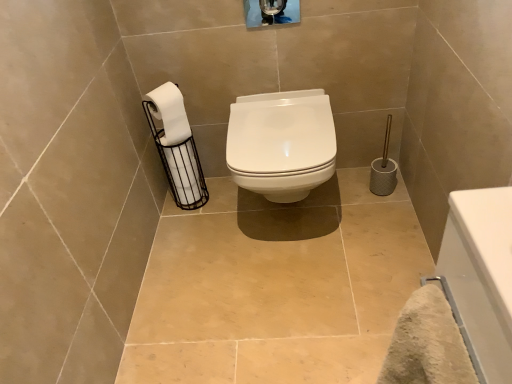
Question: Is white glossy toilet at center with white glossy bathtub at lower right?

Choices:
 (A) yes
 (B) no

Answer: (B)

Question: Considering the relative positions of white glossy toilet at center and white glossy bathtub at lower right in the image provided, is white glossy toilet at center in front of white glossy bathtub at lower right?

Choices:
 (A) yes
 (B) no

Answer: (B)

Question: Does white glossy toilet at center turn towards white glossy bathtub at lower right?

Choices:
 (A) no
 (B) yes

Answer: (B)

Question: From the image's perspective, is white glossy toilet at center below white glossy bathtub at lower right?

Choices:
 (A) no
 (B) yes

Answer: (A)

Question: Is white glossy toilet at center positioned with its back to white glossy bathtub at lower right?

Choices:
 (A) no
 (B) yes

Answer: (A)

Question: Would you say white matte toilet paper at left, marked as the first toilet paper in a front-to-back arrangement, is to the left or to the right of white glossy toilet at center in the picture?

Choices:
 (A) right
 (B) left

Answer: (B)

Question: Based on their sizes in the image, would you say white matte toilet paper at left, marked as the first toilet paper in a front-to-back arrangement, is bigger or smaller than white glossy toilet at center?

Choices:
 (A) small
 (B) big

Answer: (A)

Question: Relative to white glossy toilet at center, is white matte toilet paper at left, marked as the first toilet paper in a front-to-back arrangement, in front or behind?

Choices:
 (A) front
 (B) behind

Answer: (B)

Question: In terms of height, does white matte toilet paper at left, marked as the first toilet paper in a front-to-back arrangement, look taller or shorter compared to white glossy toilet at center?

Choices:
 (A) short
 (B) tall

Answer: (A)

Question: Is point (459, 316) positioned closer to the camera than point (162, 114)?

Choices:
 (A) closer
 (B) farther

Answer: (A)

Question: Relative to white matte toilet paper at left, marked as the first toilet paper in a front-to-back arrangement, is white glossy bathtub at lower right in front or behind?

Choices:
 (A) behind
 (B) front

Answer: (B)

Question: Do you think white glossy bathtub at lower right is within white matte toilet paper at left, which is counted as the second toilet paper, starting from the back, or outside of it?

Choices:
 (A) inside
 (B) outside

Answer: (B)

Question: From the image's perspective, is white glossy bathtub at lower right above or below white matte toilet paper at left, marked as the first toilet paper in a front-to-back arrangement?

Choices:
 (A) below
 (B) above

Answer: (A)

Question: Visually, is white matte toilet paper at left, which is counted as the second toilet paper, starting from the back, positioned to the left or to the right of white glossy bathtub at lower right?

Choices:
 (A) left
 (B) right

Answer: (A)

Question: Is white matte toilet paper at left, which is counted as the second toilet paper, starting from the back, spatially inside white glossy bathtub at lower right, or outside of it?

Choices:
 (A) outside
 (B) inside

Answer: (A)